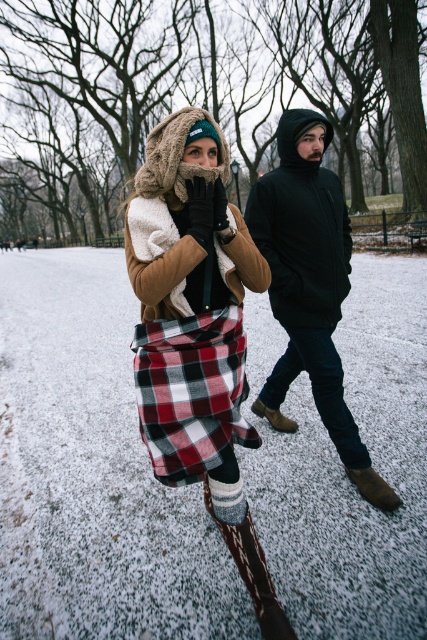
In the scene shown: You are an observer standing at the camera position. You see the plaid fabric skirt at center and the black matte jacket at center. Which object takes up more area in the image?

The black matte jacket at center occupies more area in the image than the plaid fabric skirt at center.

You are standing in the snowy park and see two points marked in the image. Which point is closer to you, point (312, 388) or point (158, 324)?

Point (312, 388) is closer to you because it is further to the viewer than point (158, 324).